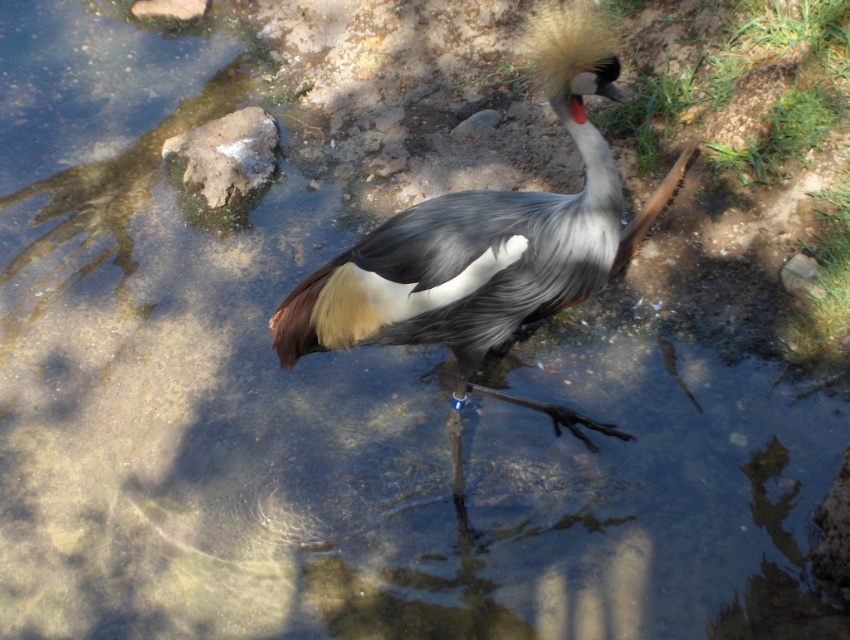
You are a small frog that can jump 2 meters. You see the smooth gray rock at upper left and the gray rock at lower right. Can you jump from one to the other?

The smooth gray rock at upper left and the gray rock at lower right are 2.56 meters apart. Since the frog can only jump 2 meters, it cannot reach the other rock in a single jump.

You are a photographer aiming to capture the Grey Crowned Crane in the image. You notice two rocks in the background. Which rock is positioned lower in the frame, the gray rock at lower right or the smooth beige rock at upper left?

The gray rock at lower right is positioned lower in the frame than the smooth beige rock at upper left.